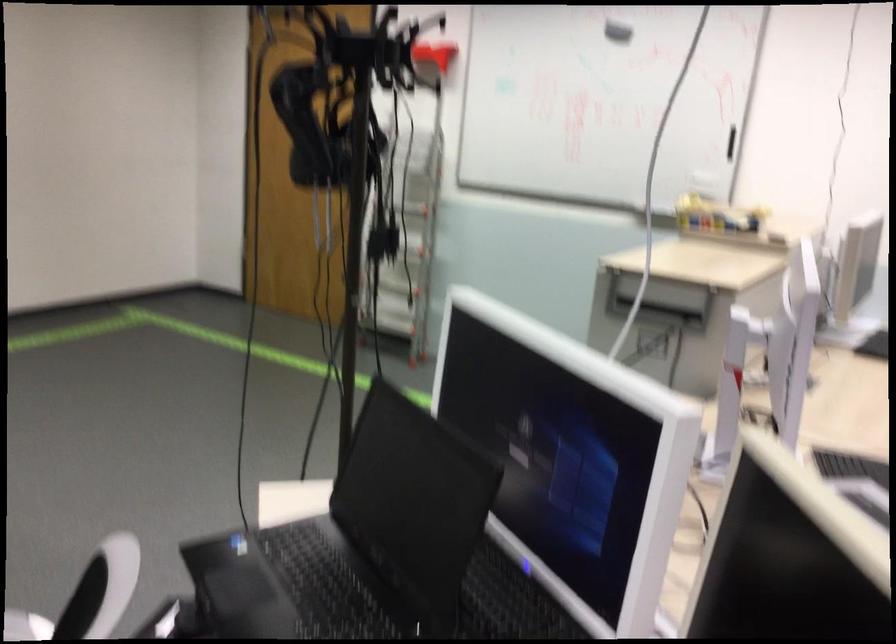
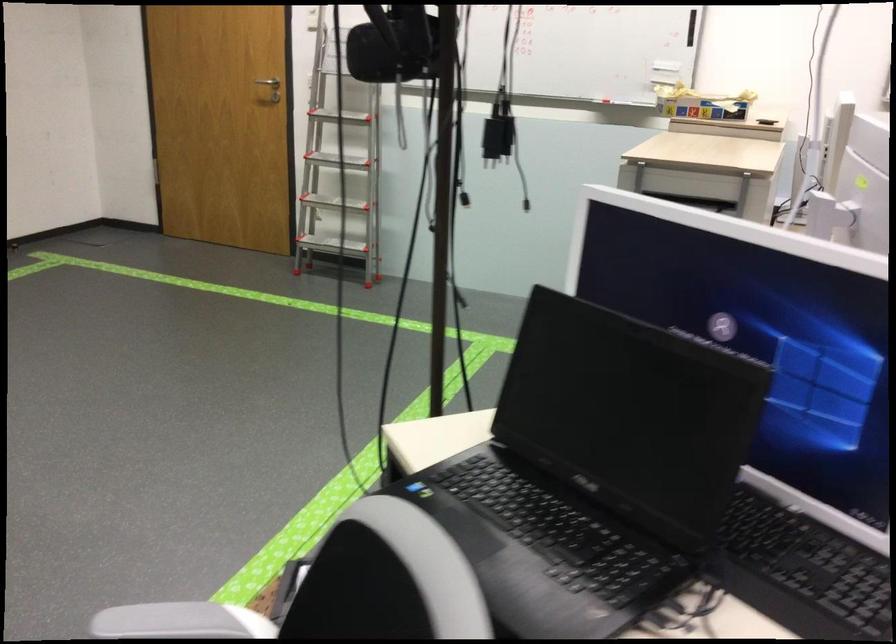
What movement of the cameraman would produce the second image?

The cameraman moved toward left, forward.